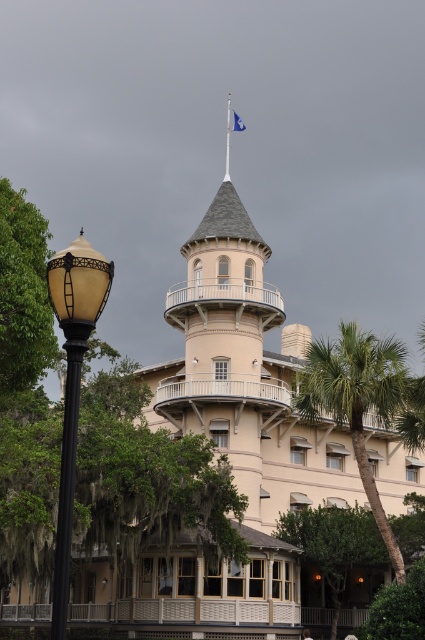
You are standing at the base of the building and looking up at the tower. Which object is closer to you between the blue fabric flagpole at top and the blue fabric flag at top?

The blue fabric flagpole at top is closer to you because it is positioned under the blue fabric flag at top.

You are standing in front of the building and notice the blue fabric flagpole at top and the blue fabric flag at top. Which one is closer to you?

The blue fabric flagpole at top is closer to you because it is in front of the blue fabric flag at top.

You are standing at the base of the building and want to locate the blue fabric flagpole at top. According to the coordinates provided, where would you look relative to the center of the building?

The blue fabric flagpole at top is located at coordinates point [227,140], which places it slightly to the left and above the center of the building.